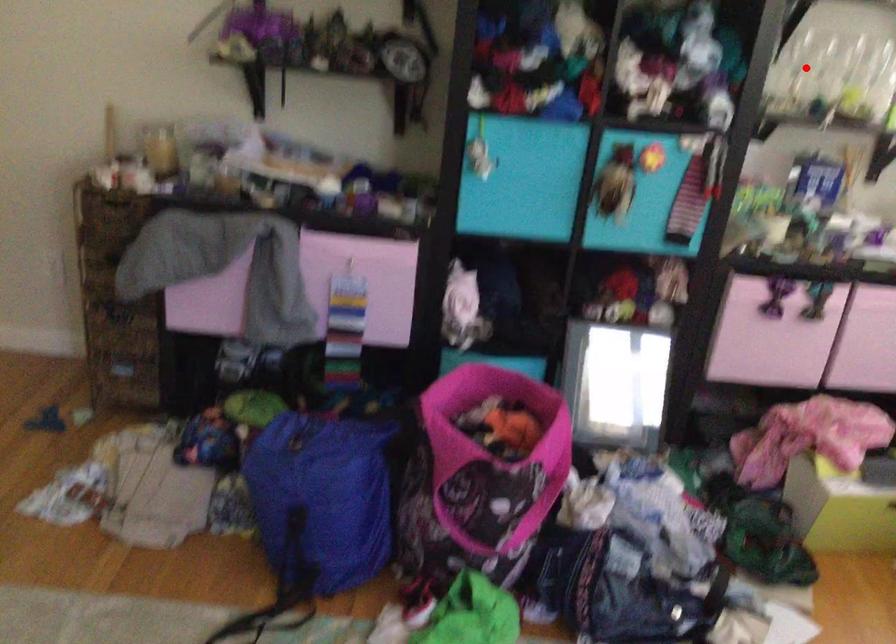
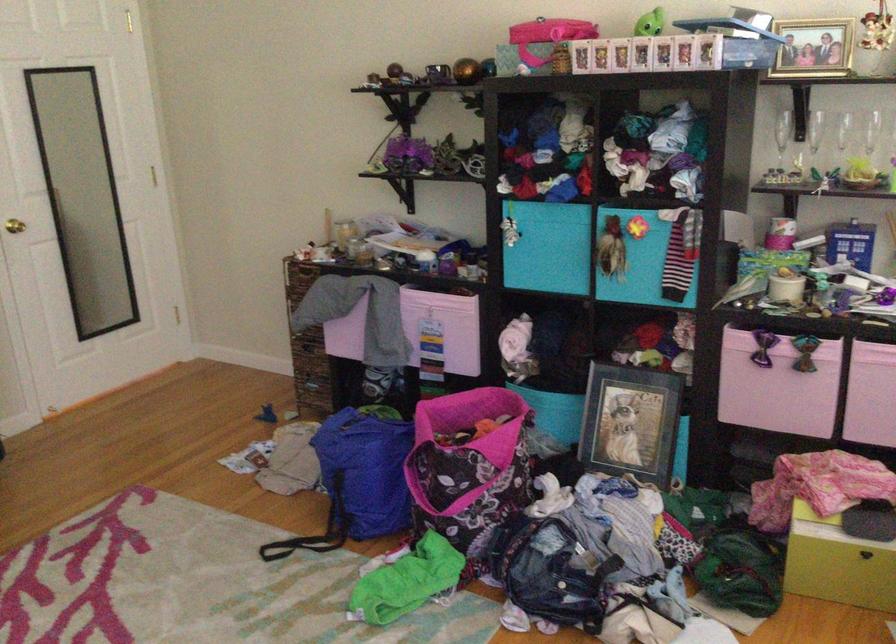
Find the pixel in the second image that matches the highlighted location in the first image.

(814, 140)